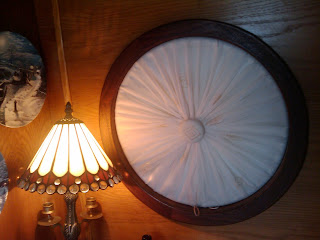
Identify the location of lamp. [x=73, y=155].